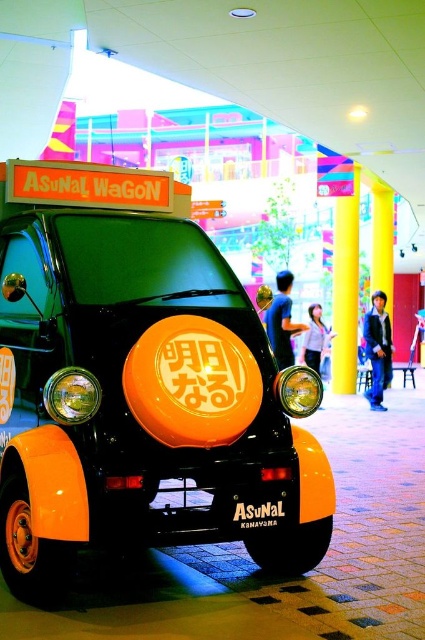
Based on the photo, does orange matte vehicle at center have a larger size compared to orange matte sign at center?

Correct, orange matte vehicle at center is larger in size than orange matte sign at center.

Does orange matte vehicle at center appear over orange matte sign at center?

Correct, orange matte vehicle at center is located above orange matte sign at center.

Between point (68, 224) and point (265, 506), which one is positioned behind?

The point (68, 224) is behind.

Where is `orange matte vehicle at center`? orange matte vehicle at center is located at coordinates (141, 388).